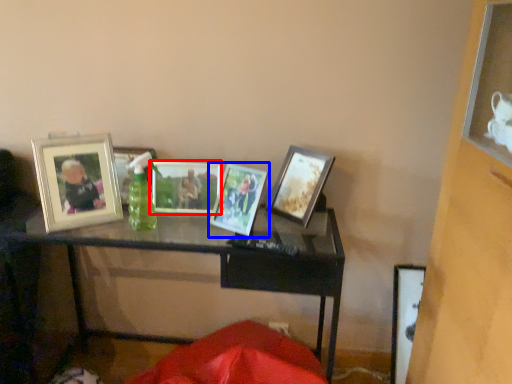
Question: Which object appears farthest to the camera in this image, picture frame (highlighted by a red box) or picture frame (highlighted by a blue box)?

Choices:
 (A) picture frame
 (B) picture frame

Answer: (A)